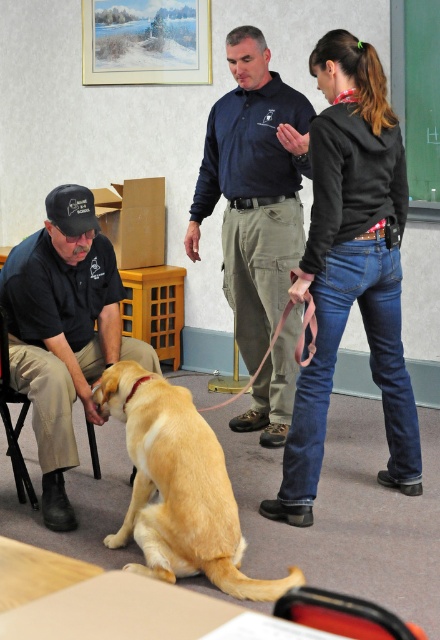
Question: Can you confirm if matte black shirt at left is smaller than black fabric chair at left?

Choices:
 (A) yes
 (B) no

Answer: (B)

Question: Which point is closer to the camera?

Choices:
 (A) (106, 333)
 (B) (33, 490)
 (C) (220, 406)

Answer: (B)

Question: Which object is positioned farthest from the pink fabric leash at center?

Choices:
 (A) black fabric chair at left
 (B) dark blue shirt at center

Answer: (A)

Question: Can you confirm if dark blue shirt at center is bigger than pink fabric leash at center?

Choices:
 (A) no
 (B) yes

Answer: (B)

Question: Which point appears closest to the camera in this image?

Choices:
 (A) (253, 378)
 (B) (256, 589)

Answer: (B)

Question: Is black cotton hoodie at center wider than golden fur dog at center?

Choices:
 (A) no
 (B) yes

Answer: (A)